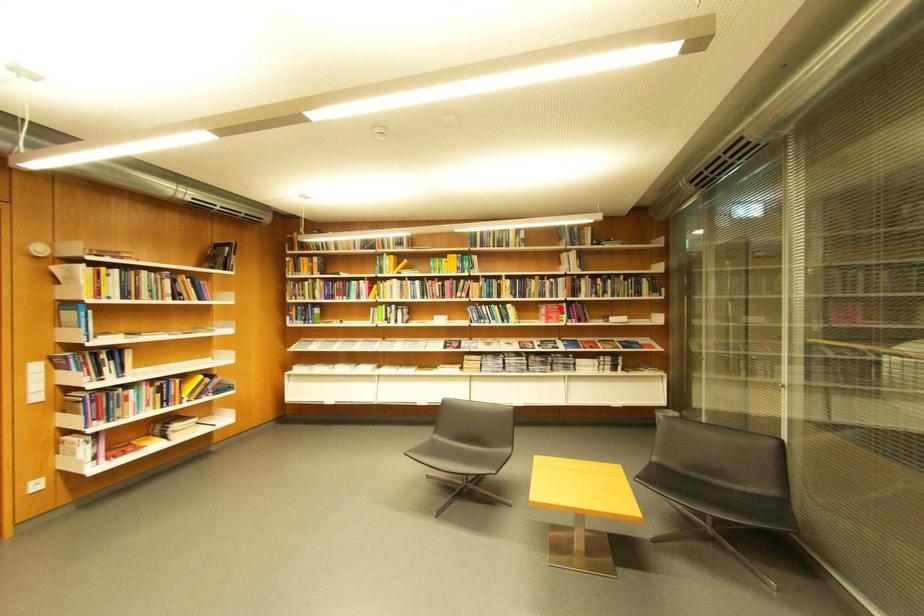
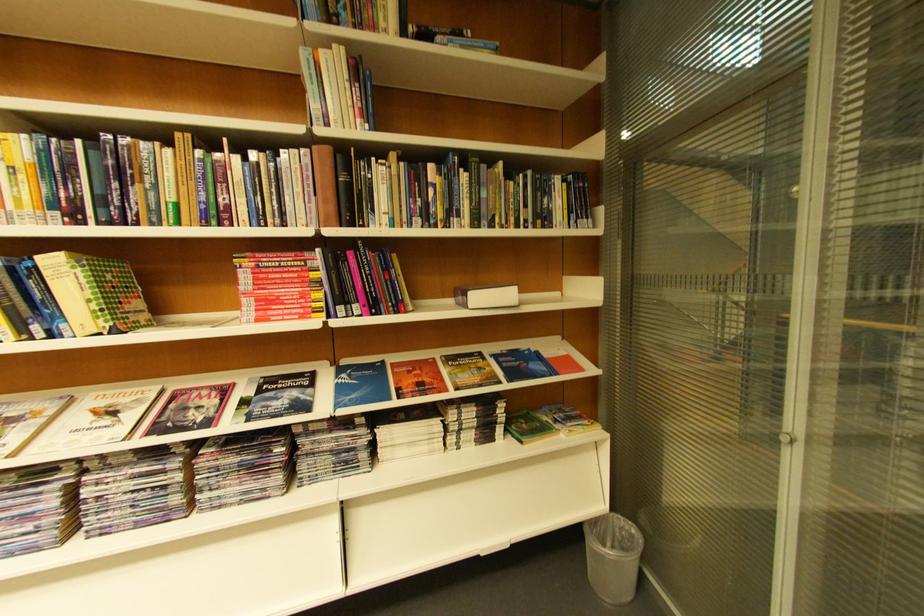
Locate, in the second image, the point that corresponds to the highlighted location in the first image.

(281, 262)